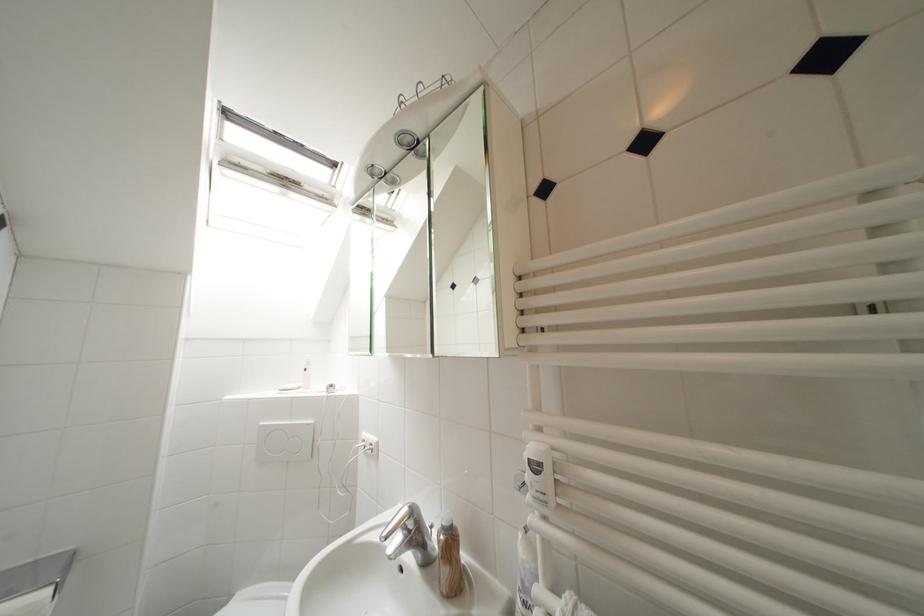
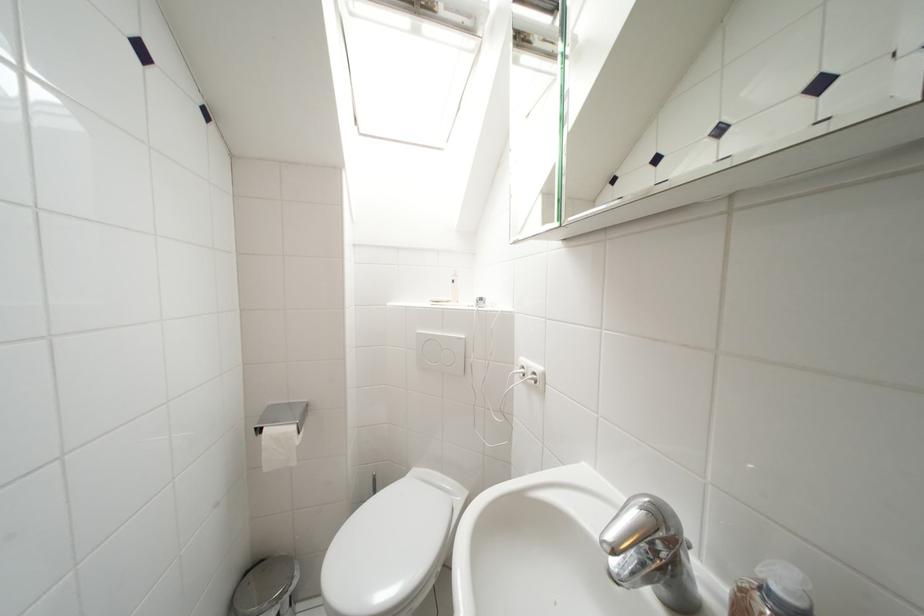
Question: The camera is either moving clockwise (left) or counter-clockwise (right) around the object. The first image is from the beginning of the video and the second image is from the end. Is the camera moving left or right when shooting the video?

Choices:
 (A) Left
 (B) Right

Answer: (B)